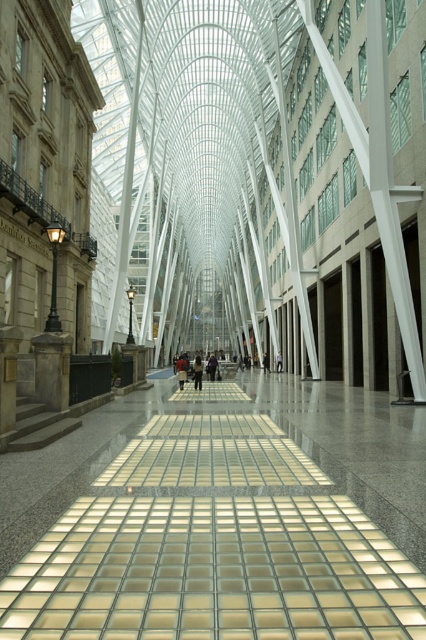
You are a photographer setting up a shoot in this modern space. You need to position two subjects wearing the dark clothing at center and dark blue jeans at center along the corridor. Since the corridor has limited space, which subject should you place closer to the walls to ensure both fit comfortably?

The dark clothing at center has a lesser width compared to dark blue jeans at center. Therefore, to ensure both fit comfortably in the corridor, the narrower dark clothing at center should be placed closer to the walls, while the wider dark blue jeans at center can be positioned towards the center of the corridor.